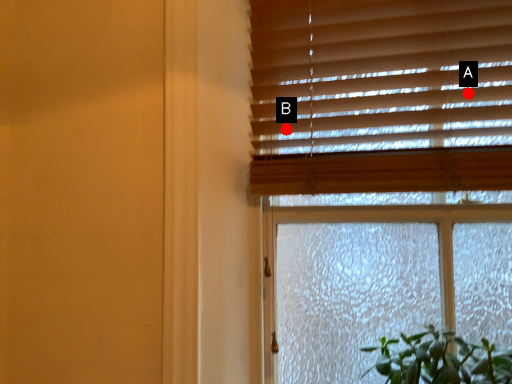
Question: Two points are circled on the image, labeled by A and B beside each circle. Which point appears farthest from the camera in this image?

Choices:
 (A) A is further
 (B) B is further

Answer: (B)